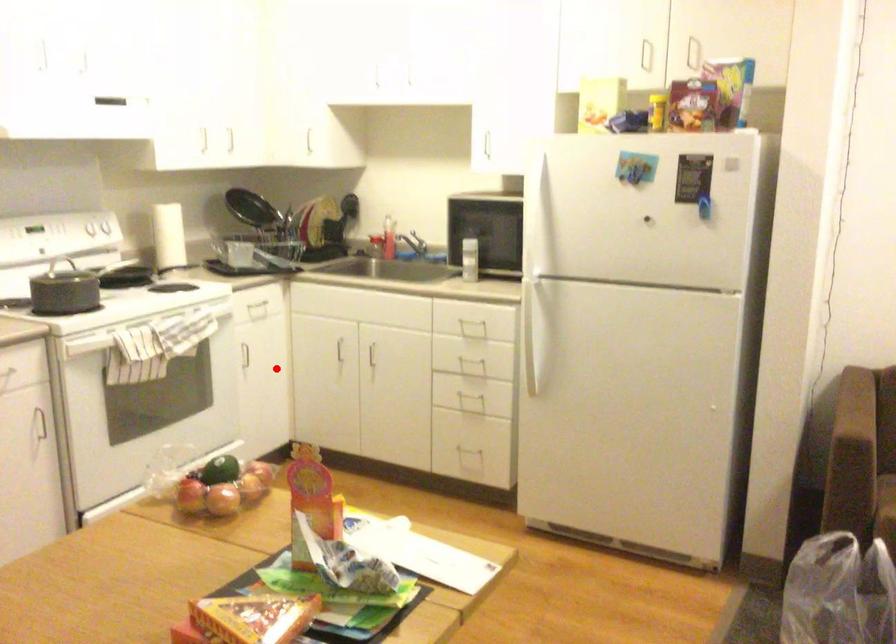
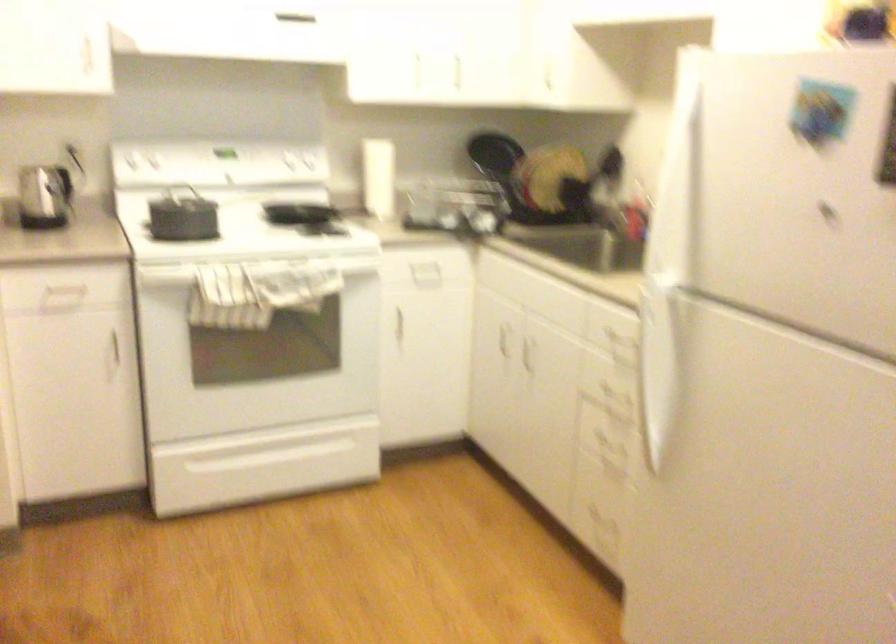
Question: I am providing you with two images of the same scene from different viewpoints. Given a red point in image1, look at the same physical point in image2. Is it:

Choices:
 (A) Closer to the viewpoint
 (B) Farther from the viewpoint

Answer: (A)